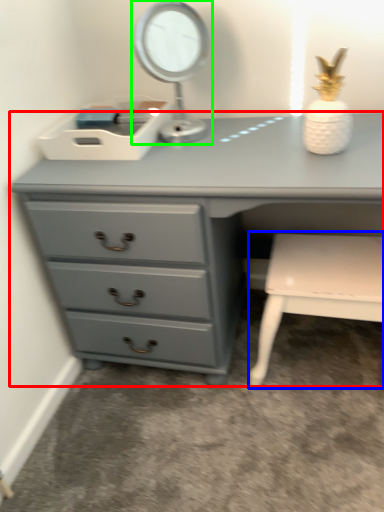
Question: Which object is the farthest from chest of drawers (highlighted by a red box)? Choose among these: chair (highlighted by a blue box) or table lamp (highlighted by a green box).

Choices:
 (A) chair
 (B) table lamp

Answer: (A)